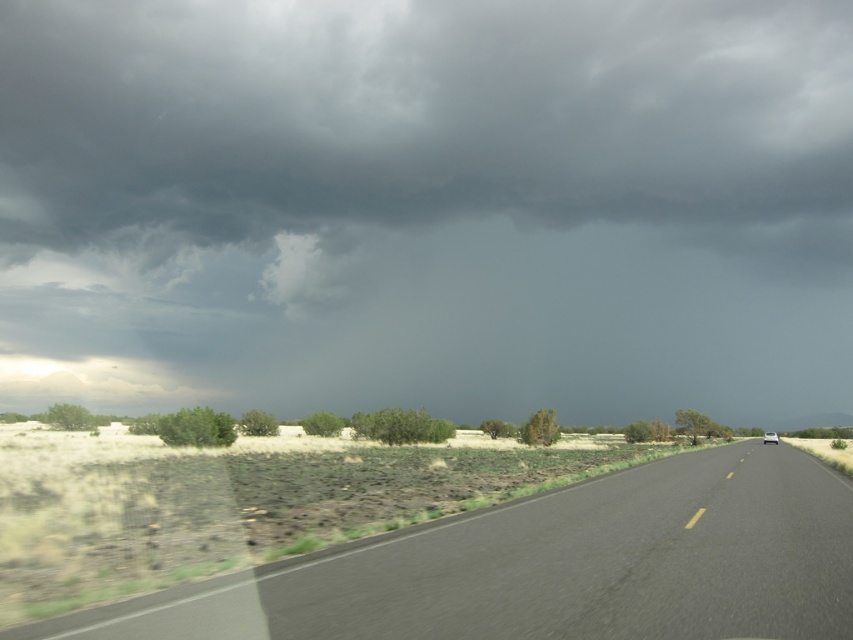
Question: Which of the following is the closest to the observer?

Choices:
 (A) black asphalt road at center
 (B) white glossy car at right

Answer: (A)

Question: Can you confirm if black asphalt road at center is bigger than white glossy car at right?

Choices:
 (A) no
 (B) yes

Answer: (A)

Question: Does black asphalt road at center have a greater width compared to white glossy car at right?

Choices:
 (A) yes
 (B) no

Answer: (B)

Question: Does black asphalt road at center appear under white glossy car at right?

Choices:
 (A) no
 (B) yes

Answer: (A)

Question: Which of the following is the closest to the observer?

Choices:
 (A) (599, 618)
 (B) (775, 436)

Answer: (A)